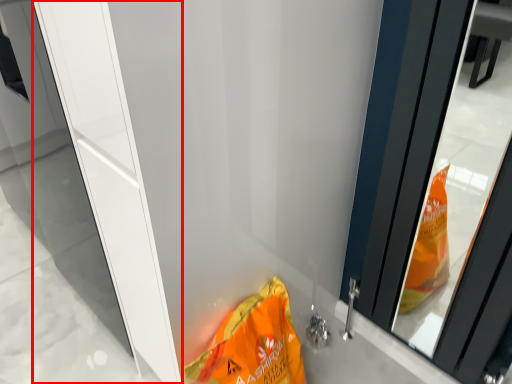
Question: Observing the image, what is the correct spatial positioning of screen door (annotated by the red box) in reference to waste?

Choices:
 (A) left
 (B) right

Answer: (A)